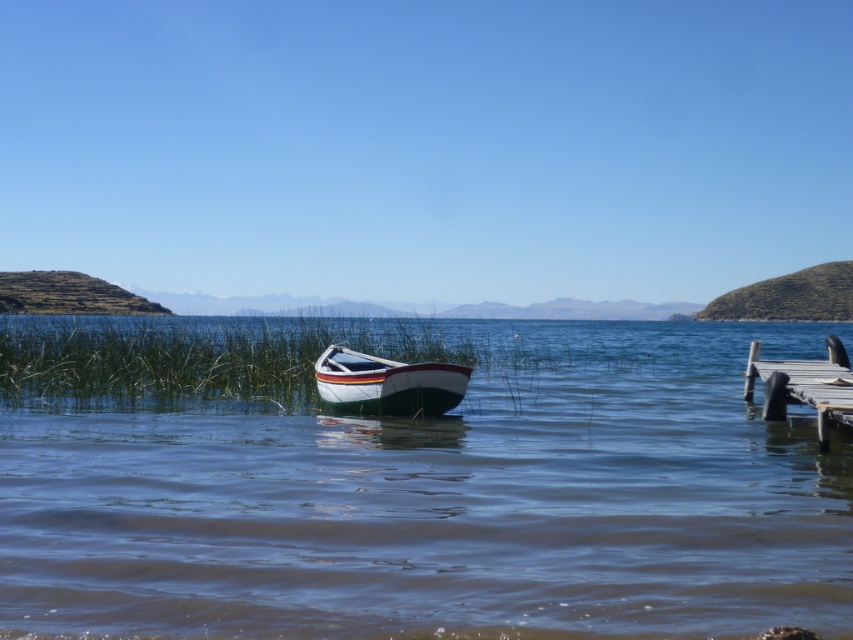
Question: Can you confirm if white wood boat at center is smaller than wooden dock at lower right?

Choices:
 (A) yes
 (B) no

Answer: (A)

Question: Among these objects, which one is farthest from the camera?

Choices:
 (A) wooden dock at lower right
 (B) clear blue water at center
 (C) white wood boat at center

Answer: (C)

Question: Based on their relative distances, which object is nearer to the wooden dock at lower right?

Choices:
 (A) clear blue water at center
 (B) white wood boat at center

Answer: (B)

Question: Can you confirm if white wood boat at center is wider than wooden dock at lower right?

Choices:
 (A) yes
 (B) no

Answer: (B)

Question: Is clear blue water at center thinner than wooden dock at lower right?

Choices:
 (A) yes
 (B) no

Answer: (B)

Question: Considering the real-world distances, which object is closest to the clear blue water at center?

Choices:
 (A) white wood boat at center
 (B) wooden dock at lower right

Answer: (B)